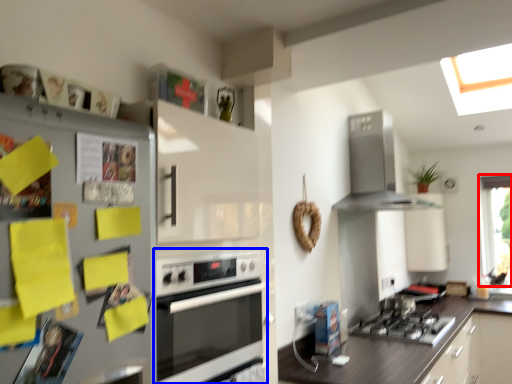
Question: Which object appears closest to the camera in this image, window (highlighted by a red box) or oven (highlighted by a blue box)?

Choices:
 (A) window
 (B) oven

Answer: (B)